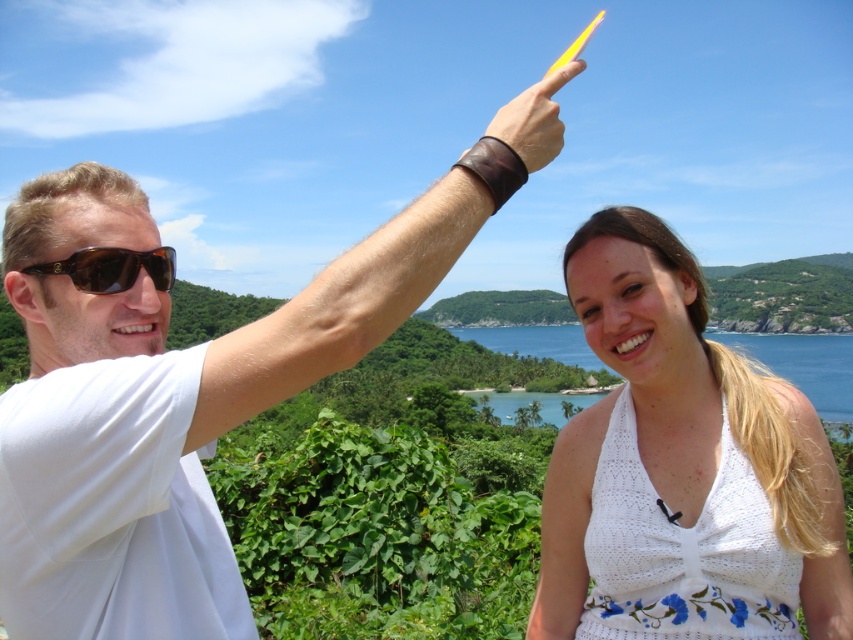
You are a photographer trying to capture a photo of the yellow plastic stick at upper center. You notice the brown matte sunglasses at upper left might block the view. Based on their positions, can you position yourself so that the sunglasses are not in the frame while keeping the stick centered?

The brown matte sunglasses at upper left is to the left of the yellow plastic stick at upper center. To avoid blocking the view, move to the right side so the sunglasses are out of frame while keeping the stick centered.

You are a photographer trying to capture a shot of the white crochet dress at center and the brown matte sunglasses at upper left. Since you want to ensure both are clearly visible, which object should you focus on first to avoid blurring due to their size difference?

The white crochet dress at center is wider than the brown matte sunglasses at upper left, so you should focus on the white crochet dress at center first to ensure it is sharp and in focus before the smaller sunglasses.